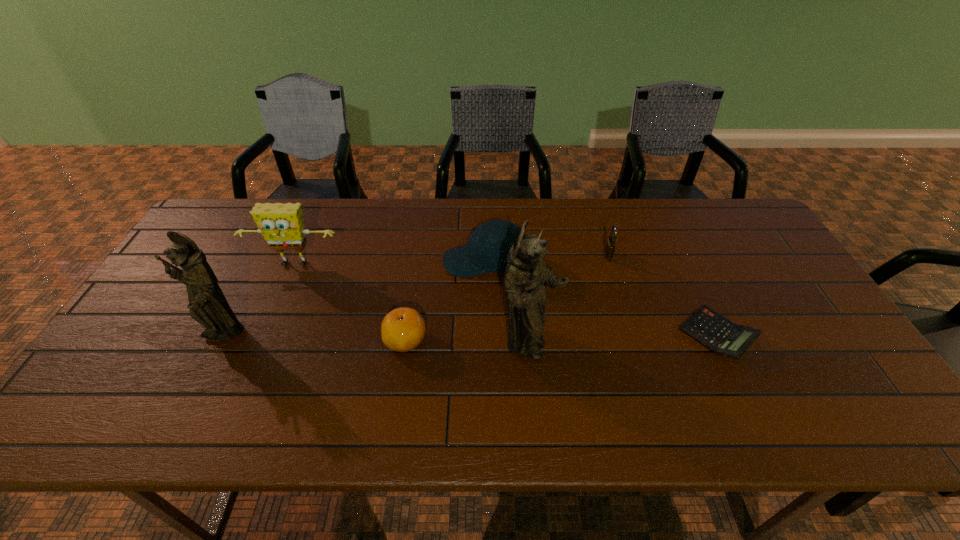
Locate an element on the screen. vacant space that satisfies the following two spatial constraints: 1. on the front-facing side of the fourth shortest object; 2. on the front side of the second shortest object is located at coordinates (486, 340).